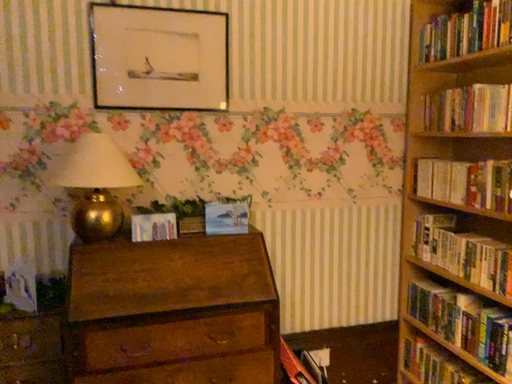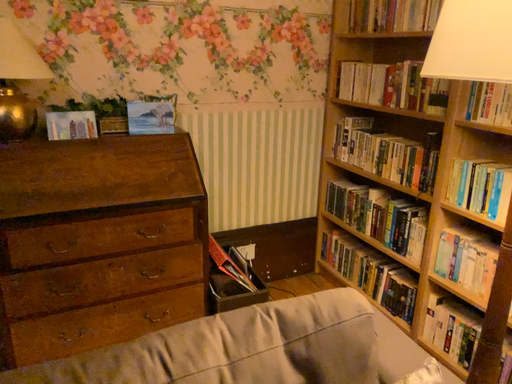
Question: How did the camera likely rotate when shooting the video?

Choices:
 (A) rotated left
 (B) rotated right

Answer: (B)